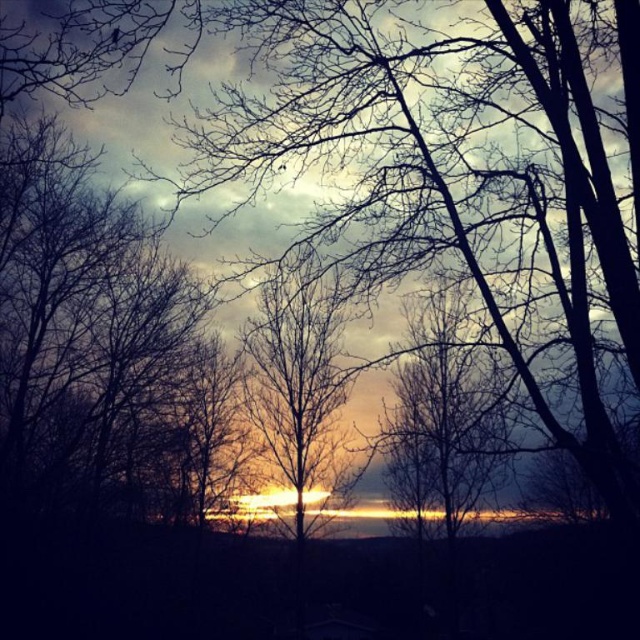
Between silhouette bare tree at center and silhouetted bare tree at center, which one appears on the right side from the viewer's perspective?

silhouette bare tree at center

Looking at this image, is silhouette bare tree at center positioned at the back of silhouetted bare tree at center?

No, silhouette bare tree at center is closer to the viewer.

Is point (474, 442) closer to camera compared to point (282, 330)?

Yes.

Find the location of `silhouette bare tree at center`. silhouette bare tree at center is located at coordinates [x=442, y=417].